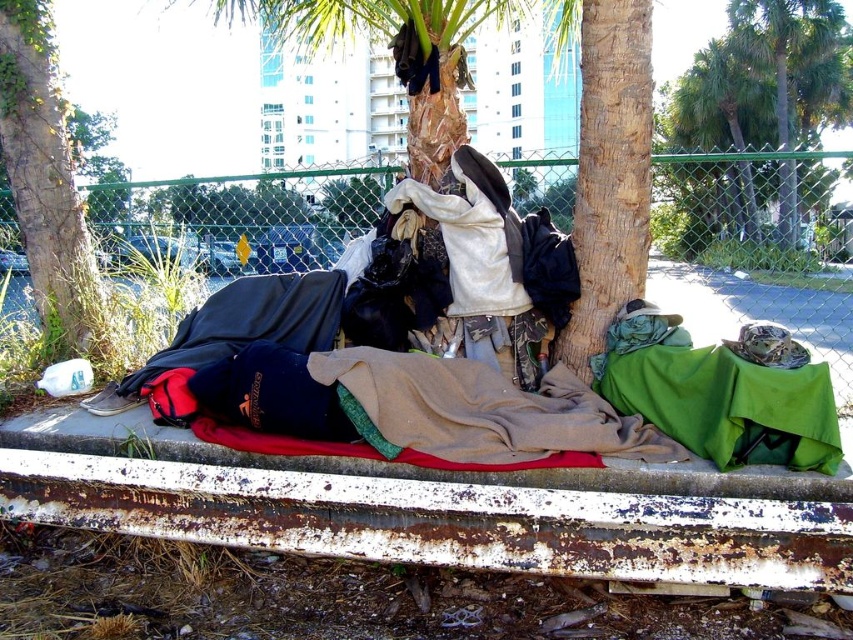
Question: From the image, what is the correct spatial relationship of camouflage fabric clothing at center in relation to green rough bark tree at lower left?

Choices:
 (A) right
 (B) left

Answer: (A)

Question: Which object appears farthest from the camera in this image?

Choices:
 (A) camouflage fabric pants at center
 (B) green rough bark tree at lower left
 (C) green leafy palm tree at center
 (D) bark textured tree at center

Answer: (B)

Question: Is camouflage fabric clothing at center thinner than bark textured tree at center?

Choices:
 (A) yes
 (B) no

Answer: (B)

Question: Among these points, which one is nearest to the camera?

Choices:
 (A) (695, 301)
 (B) (521, 289)

Answer: (B)

Question: Is camouflage fabric pants at center bigger than green leafy palm tree at center?

Choices:
 (A) no
 (B) yes

Answer: (A)

Question: Which point appears farthest from the camera in this image?

Choices:
 (A) (372, 237)
 (B) (264, 244)
 (C) (659, 236)
 (D) (598, 150)

Answer: (B)